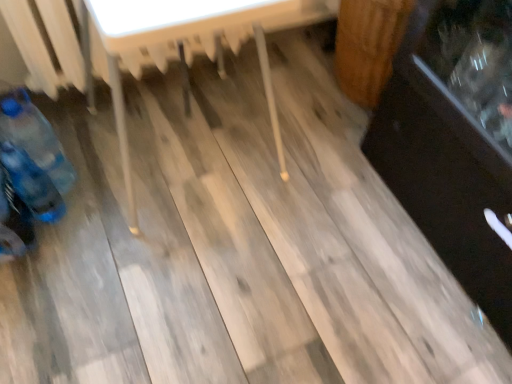
Question: Is blue plastic bottle at left, marked as the 2th bottle in a bottom-to-top arrangement, smaller than wooden table at center?

Choices:
 (A) no
 (B) yes

Answer: (B)

Question: From a real-world perspective, is blue plastic bottle at left, arranged as the 1th bottle when viewed from the top, positioned under wooden table at center based on gravity?

Choices:
 (A) yes
 (B) no

Answer: (A)

Question: Are blue plastic bottle at left, arranged as the 1th bottle when viewed from the top, and wooden table at center located far from each other?

Choices:
 (A) no
 (B) yes

Answer: (A)

Question: Is blue plastic bottle at left, arranged as the 1th bottle when viewed from the top, thinner than wooden table at center?

Choices:
 (A) yes
 (B) no

Answer: (A)

Question: Considering the relative sizes of blue plastic bottle at left, marked as the 2th bottle in a bottom-to-top arrangement, and wooden table at center in the image provided, is blue plastic bottle at left, marked as the 2th bottle in a bottom-to-top arrangement, wider than wooden table at center?

Choices:
 (A) yes
 (B) no

Answer: (B)

Question: Looking at the image, does wooden table at center seem bigger or smaller compared to blue plastic bottle at left, arranged as the 1th bottle when viewed from the top?

Choices:
 (A) small
 (B) big

Answer: (B)

Question: Is wooden table at center inside or outside of blue plastic bottle at left, arranged as the 1th bottle when viewed from the top?

Choices:
 (A) outside
 (B) inside

Answer: (A)

Question: In the image, is wooden table at center positioned in front of or behind blue plastic bottle at left, marked as the 2th bottle in a bottom-to-top arrangement?

Choices:
 (A) front
 (B) behind

Answer: (A)

Question: From the image's perspective, relative to blue plastic bottle at left, arranged as the 1th bottle when viewed from the top, is wooden table at center above or below?

Choices:
 (A) above
 (B) below

Answer: (A)

Question: Is blue plastic bottle at lower left, positioned as the 2th bottle in top-to-bottom order, to the left or to the right of blue plastic bottle at left, arranged as the 1th bottle when viewed from the top, in the image?

Choices:
 (A) right
 (B) left

Answer: (A)

Question: Choose the correct answer: Is blue plastic bottle at lower left, the first bottle in the bottom-to-top sequence, inside blue plastic bottle at left, marked as the 2th bottle in a bottom-to-top arrangement, or outside it?

Choices:
 (A) outside
 (B) inside

Answer: (A)

Question: From a real-world perspective, is blue plastic bottle at lower left, positioned as the 2th bottle in top-to-bottom order, physically located above or below blue plastic bottle at left, arranged as the 1th bottle when viewed from the top?

Choices:
 (A) below
 (B) above

Answer: (A)

Question: In terms of width, does blue plastic bottle at lower left, the first bottle in the bottom-to-top sequence, look wider or thinner when compared to blue plastic bottle at left, marked as the 2th bottle in a bottom-to-top arrangement?

Choices:
 (A) wide
 (B) thin

Answer: (B)

Question: Considering their positions, is blue plastic bottle at left, marked as the 2th bottle in a bottom-to-top arrangement, located in front of or behind wooden table at center?

Choices:
 (A) behind
 (B) front

Answer: (A)

Question: Is blue plastic bottle at left, arranged as the 1th bottle when viewed from the top, wider or thinner than wooden table at center?

Choices:
 (A) wide
 (B) thin

Answer: (B)